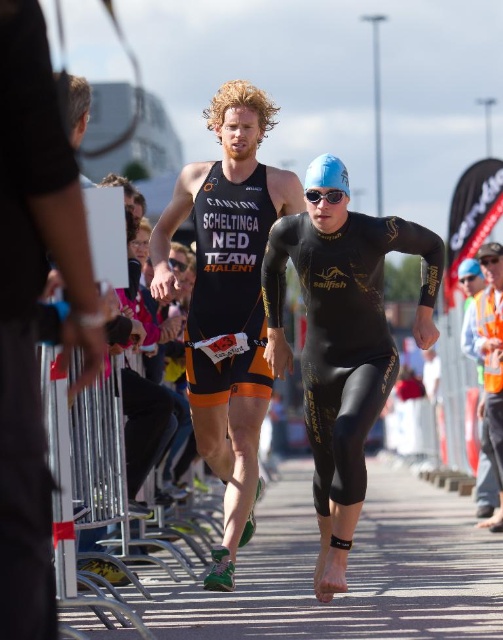
Does orange reflective vest at right come in front of blue matte swim cap at center?

No, orange reflective vest at right is behind blue matte swim cap at center.

Who is shorter, orange reflective vest at right or blue matte swim cap at center?

blue matte swim cap at center

Is point (497, 294) more distant than point (337, 173)?

Yes, point (497, 294) is behind point (337, 173).

Identify the location of orange reflective vest at right. The width and height of the screenshot is (503, 640). 490,364.

Is the position of black matte goggles at center more distant than that of blue matte swim cap at upper center?

That is False.

Which of these two, black matte goggles at center or blue matte swim cap at upper center, stands shorter?

black matte goggles at center

Who is more forward, (314, 192) or (466, 275)?

Point (314, 192) is more forward.

Identify the location of black matte goggles at center. (324, 195).

The width and height of the screenshot is (503, 640). What do you see at coordinates (227, 300) in the screenshot?
I see `black triathlon suit at center` at bounding box center [227, 300].

Identify the location of black triathlon suit at center. The height and width of the screenshot is (640, 503). (227, 300).

This screenshot has height=640, width=503. I want to click on black triathlon suit at center, so click(227, 300).